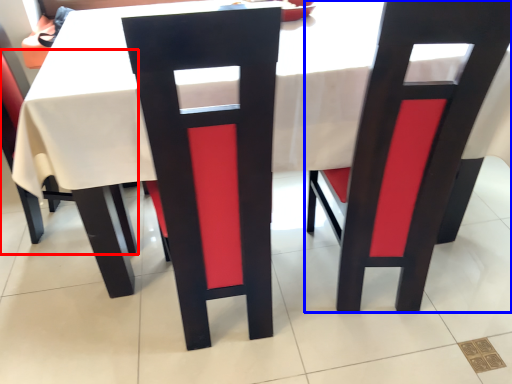
Question: Which object is further to the camera taking this photo, chair (highlighted by a red box) or chair (highlighted by a blue box)?

Choices:
 (A) chair
 (B) chair

Answer: (A)